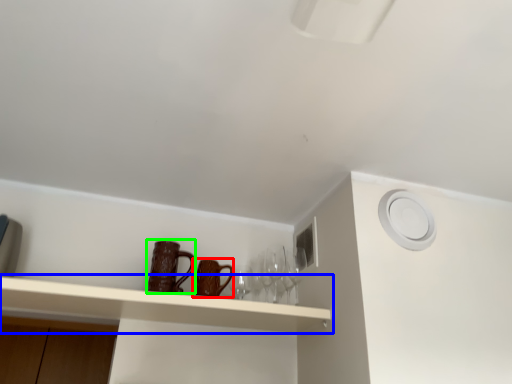
Question: Estimate the real-world distances between objects in this image. Which object is closer to mug (highlighted by a red box), shelf (highlighted by a blue box) or mug (highlighted by a green box)?

Choices:
 (A) shelf
 (B) mug

Answer: (B)